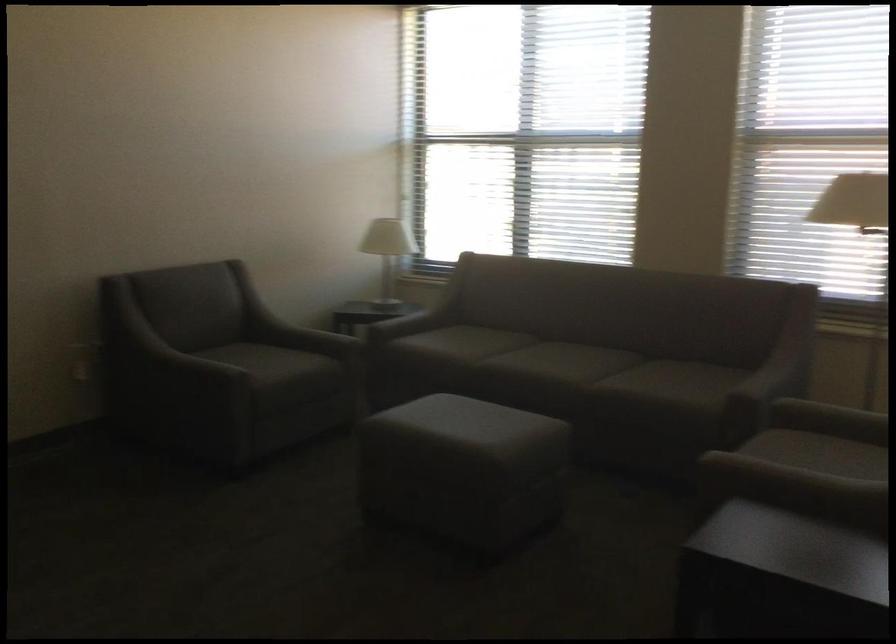
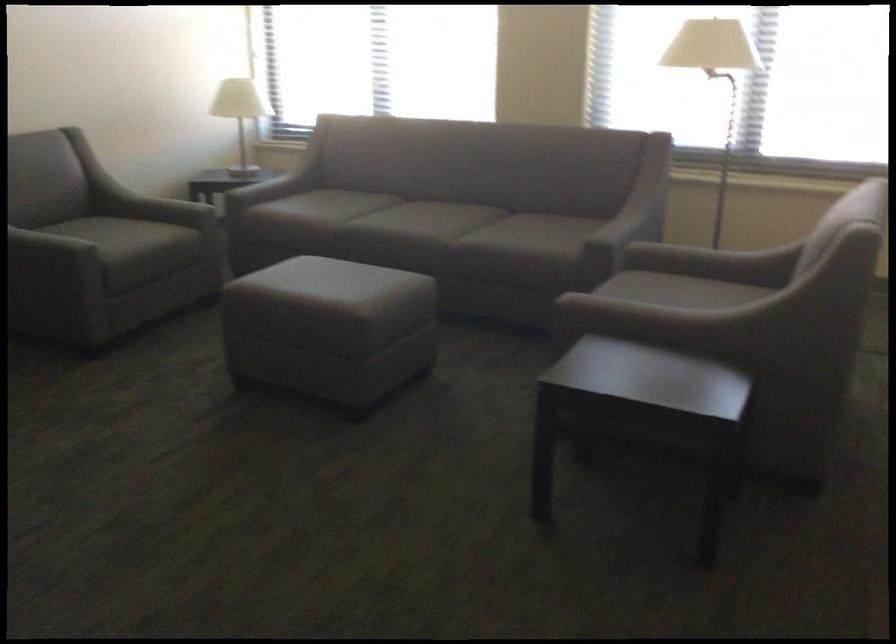
Question: Based on the continuous images, in which direction is the camera rotating? Reply with the corresponding letter.

Choices:
 (A) Left
 (B) Right
 (C) Up
 (D) Down

Answer: (D)